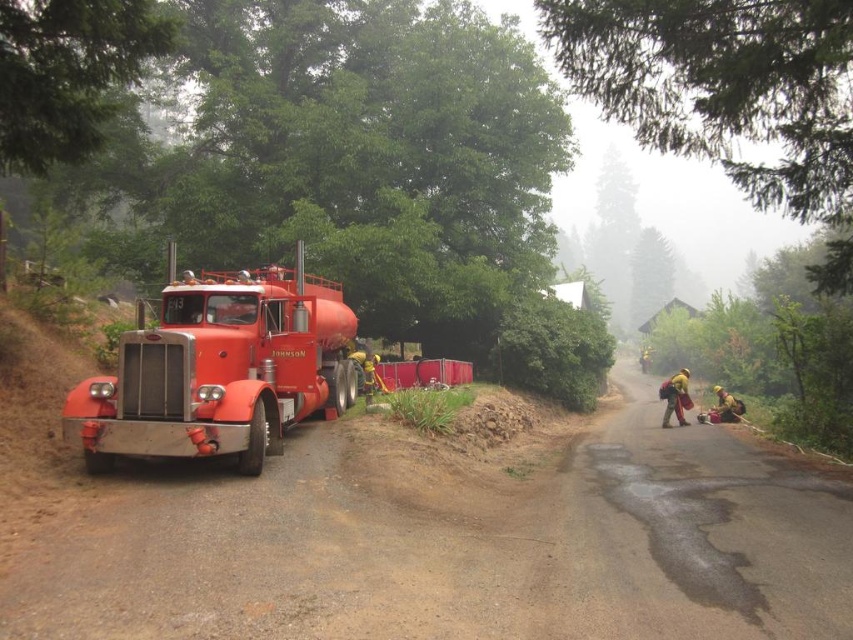
Question: Is the position of shiny red tanker truck at left more distant than that of yellow fabric backpack at lower right?

Choices:
 (A) yes
 (B) no

Answer: (B)

Question: Can you confirm if shiny red tanker truck at left is positioned to the left of yellow fireproof suit at lower right?

Choices:
 (A) yes
 (B) no

Answer: (A)

Question: Which point is closer to the camera taking this photo?

Choices:
 (A) (305, 364)
 (B) (94, 588)
 (C) (720, 420)
 (D) (679, 412)

Answer: (B)

Question: Which of the following is the farthest from the observer?

Choices:
 (A) (312, 512)
 (B) (660, 387)
 (C) (189, 308)
 (D) (701, 420)

Answer: (B)

Question: Estimate the real-world distances between objects in this image. Which object is closer to the shiny red tanker truck at left?

Choices:
 (A) yellow fireproof suit at lower right
 (B) dirt track at left

Answer: (B)

Question: Is dirt track at left to the left of yellow fireproof suit at lower right from the viewer's perspective?

Choices:
 (A) yes
 (B) no

Answer: (A)